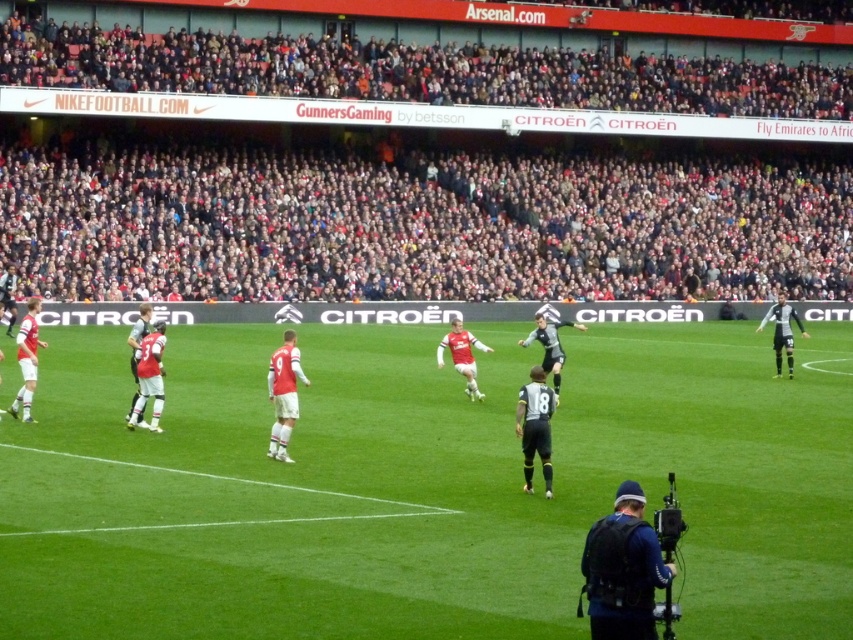
Can you confirm if dark gray crowd at upper center is thinner than dark gray jersey at center?

No.

Identify the location of dark gray crowd at upper center. This screenshot has width=853, height=640. (418, 220).

The width and height of the screenshot is (853, 640). What are the coordinates of `dark gray crowd at upper center` in the screenshot? It's located at (418, 220).

Between point (177, 244) and point (793, 314), which one is positioned in front?

Point (793, 314) is more forward.

Where is `dark gray crowd at upper center`? This screenshot has height=640, width=853. dark gray crowd at upper center is located at coordinates (418, 220).

Where is `dark gray crowd at upper center`? This screenshot has height=640, width=853. dark gray crowd at upper center is located at coordinates (418, 220).

Who is taller, green grass football field at center or dark gray crowd at upper center?

dark gray crowd at upper center is taller.

Which is in front, point (296, 563) or point (379, 294)?

Positioned in front is point (296, 563).

Locate an element on the screen. green grass football field at center is located at coordinates (422, 486).